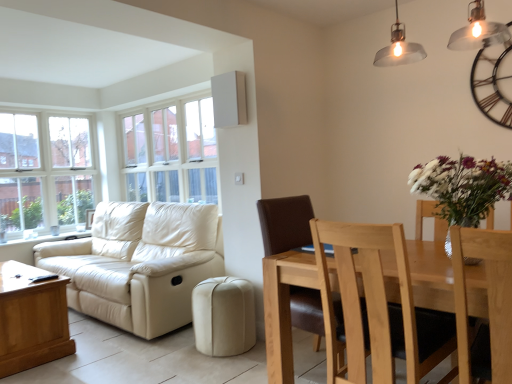
This screenshot has width=512, height=384. Identify the location of vacant space situated on the left part of beige leather ottoman at lower center. (170, 353).